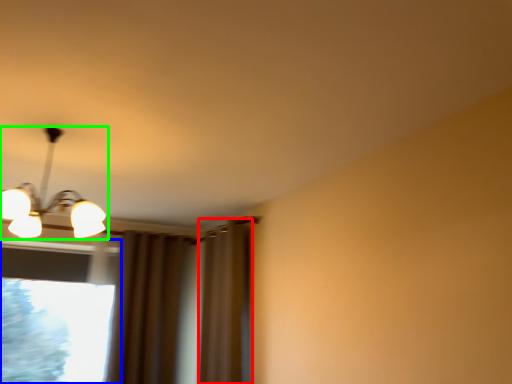
Question: Based on their relative distances, which object is farther from curtain (highlighted by a red box)? Choose from window (highlighted by a blue box) and lamp (highlighted by a green box).

Choices:
 (A) window
 (B) lamp

Answer: (B)